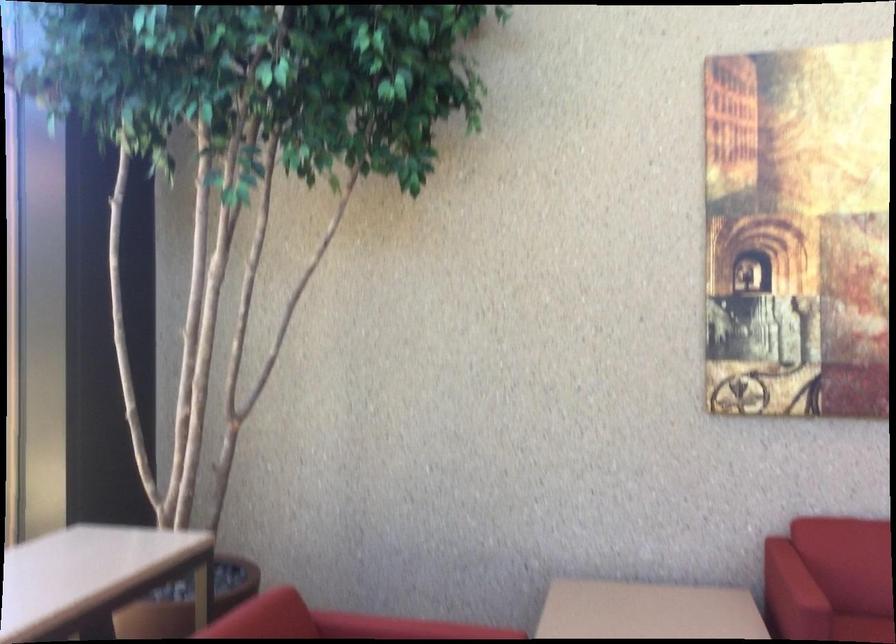
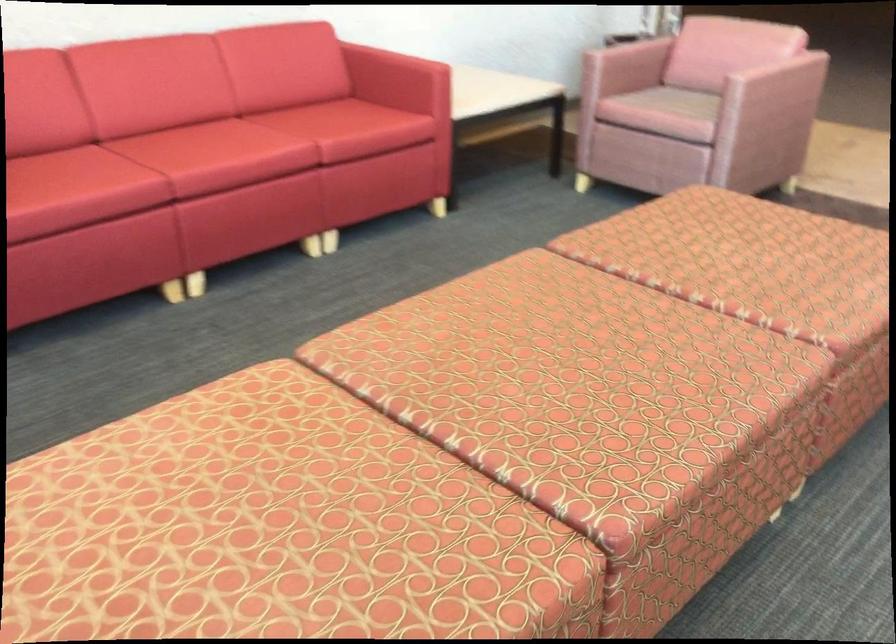
Based on the continuous images, in which direction is the camera rotating?

The camera's rotation is toward right-down.